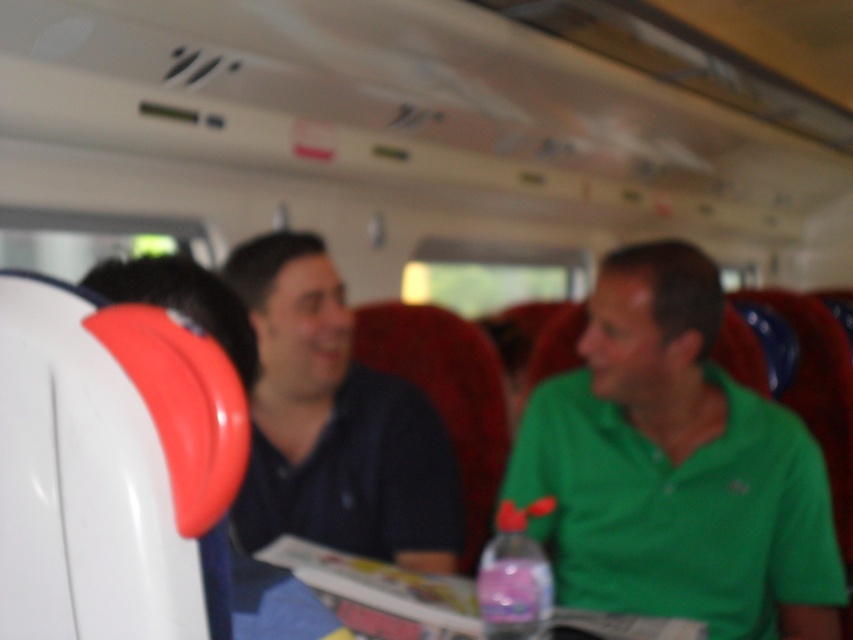
You are a passenger sitting in the train and you want to know which shirt is taller between the green matte shirt at center and the dark blue shirt at center. Can you tell me?

The green matte shirt at center is much taller than the dark blue shirt at center.

Based on the photo, you are a passenger on a train and you want to know which shirt is closer to the floor between the green matte shirt at center and the dark blue shirt at center. Based on the scene description, which one is lower?

The green matte shirt at center is located below dark blue shirt at center, so the green matte shirt at center is closer to the floor.

Based on the photo, you are sitting in the middle of the train car and notice two people wearing shirts of different colors. The green matte shirt at center and the dark blue shirt at center. Which shirt is positioned closer to you?

The green matte shirt at center is closer to the viewer than the dark blue shirt at center.